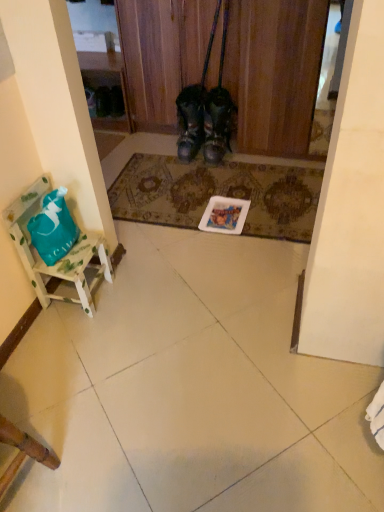
Where is `vacant space underneath leather boots at center, the first footwear viewed from the left (from a real-world perspective)`? This screenshot has width=384, height=512. vacant space underneath leather boots at center, the first footwear viewed from the left (from a real-world perspective) is located at coordinates coord(185,155).